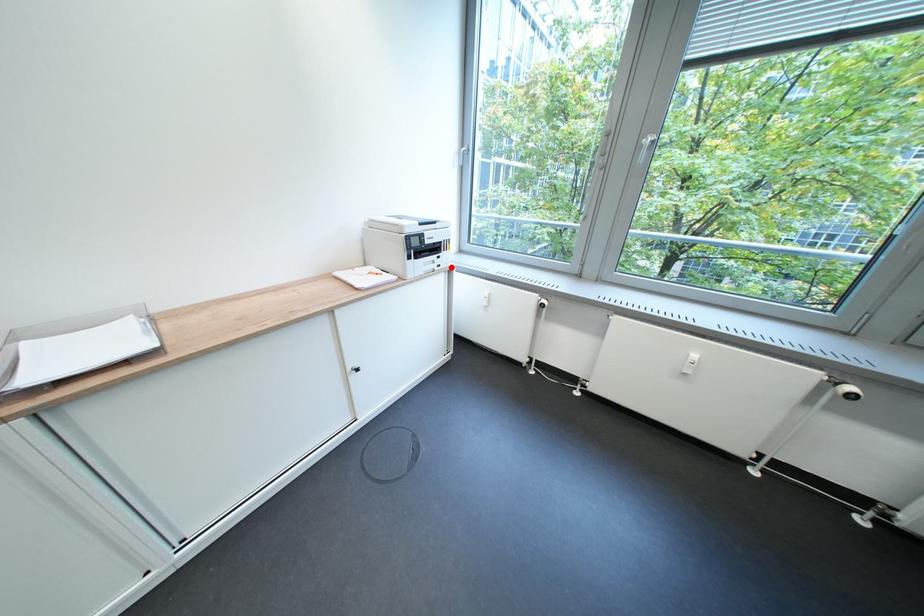
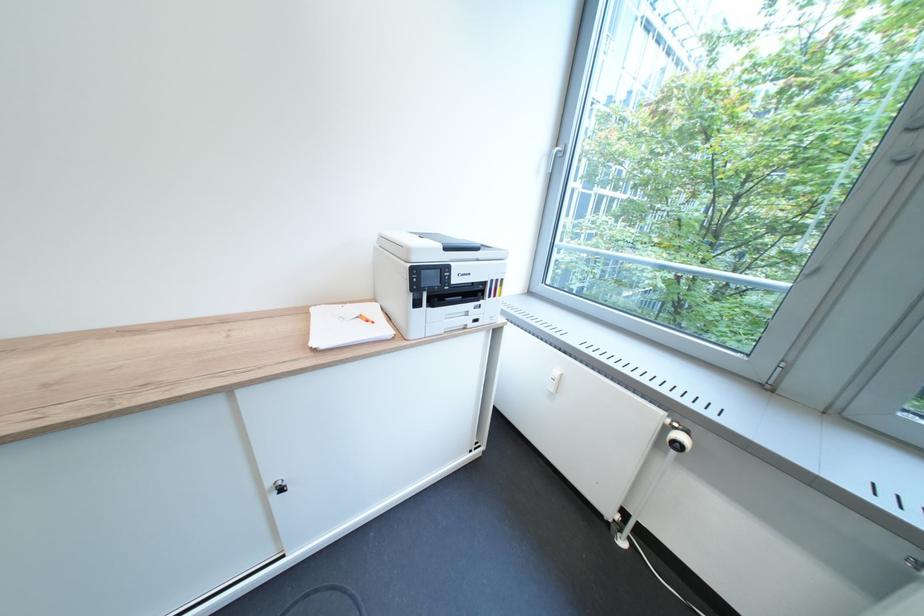
Question: I am providing you with two images of the same scene from different viewpoints. In image1, a red point is highlighted. Considering the same 3D point in image2, which of the following is correct?

Choices:
 (A) It is closer
 (B) It is farther

Answer: (B)